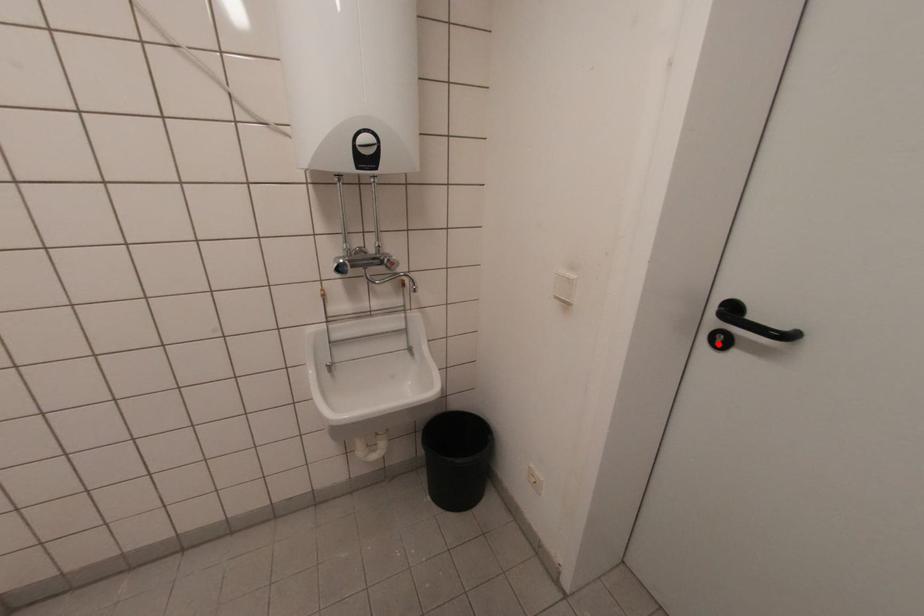
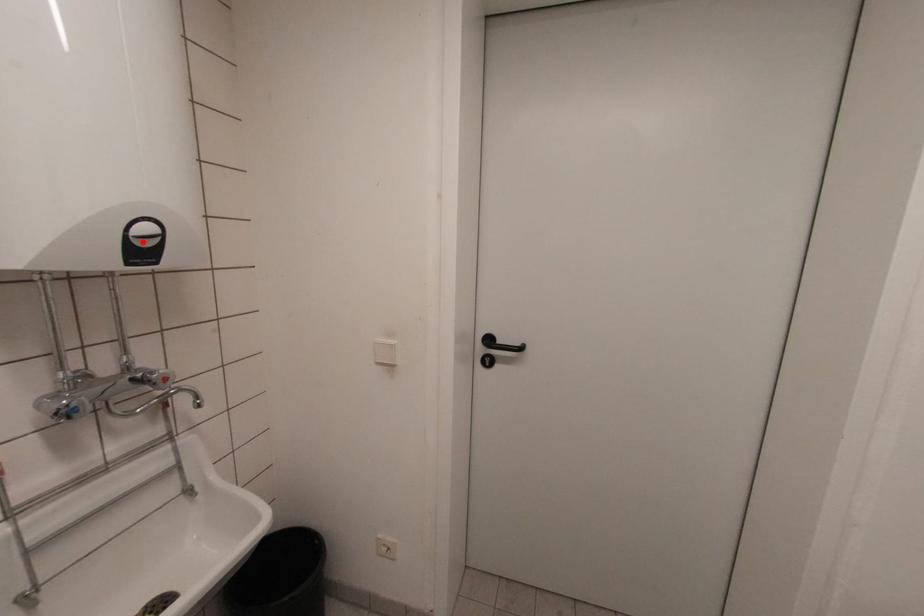
I am providing you with two images of the same scene from different viewpoints. A red point is marked on the first image and another point is marked on the second image. Are the points marked in image1 and image2 representing the same 3D position?

No